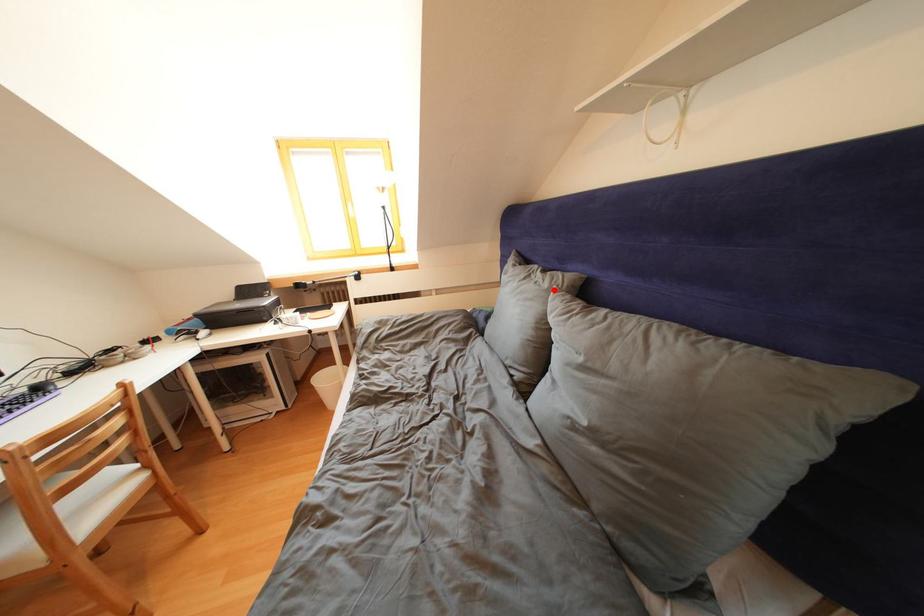
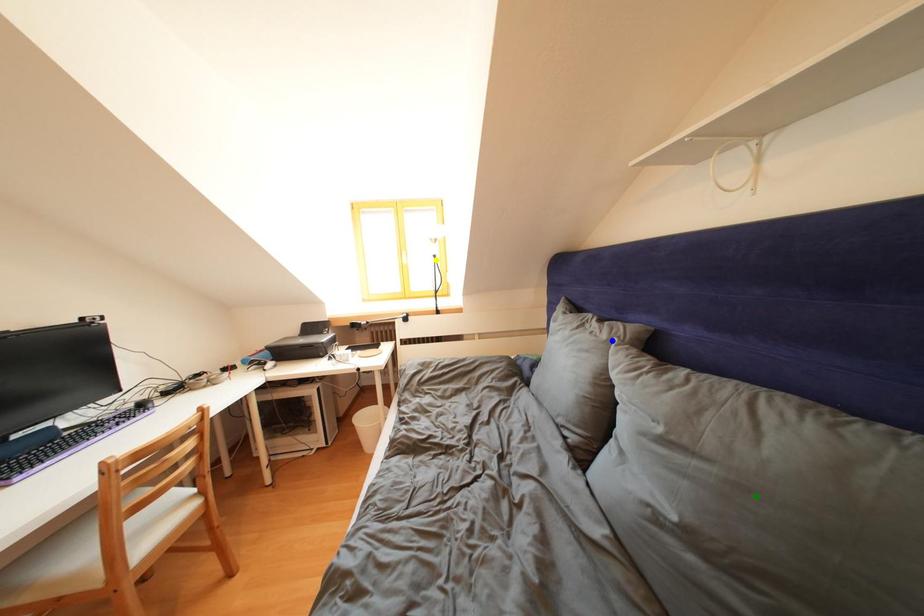
Question: I am providing you with two images of the same scene from different viewpoints. A red point is marked on the first image. You are given multiple points on the second image. In image 2, which mark is for the same physical point as the one in image 1?

Choices:
 (A) green point
 (B) yellow point
 (C) blue point

Answer: (C)